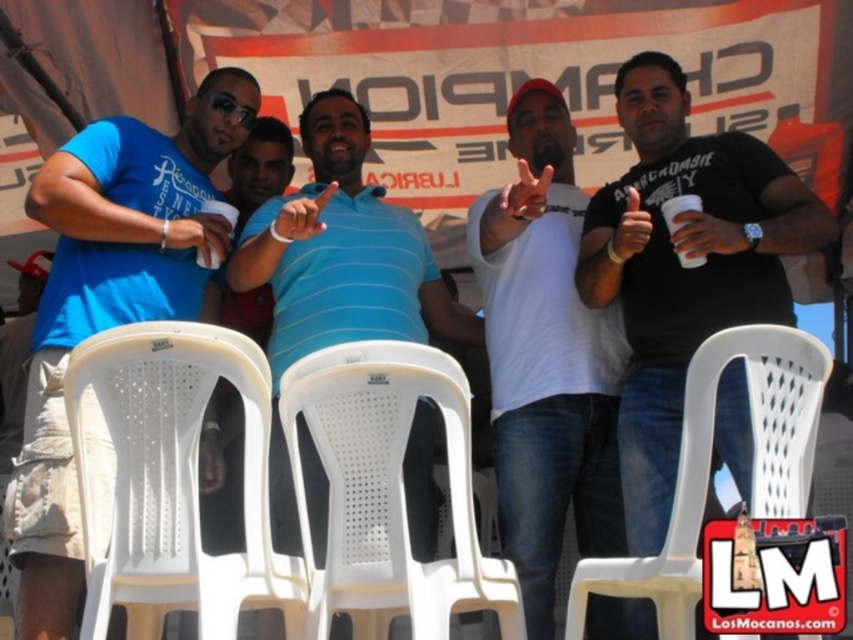
You are a photographer trying to position a new subject between the white plastic chair at lower left and the blue striped polo shirt at center. Which object should you place the subject closer to if you want the subject to appear larger in the photo?

To make the subject appear larger in the photo, you should place them closer to the blue striped polo shirt at center since it is larger than the white plastic chair at lower left.

In the photo, there are a white plastic chair at lower left and a blue striped polo shirt at center. Which object is positioned more to the left?

The white plastic chair at lower left is positioned more to the left than the blue striped polo shirt at center.